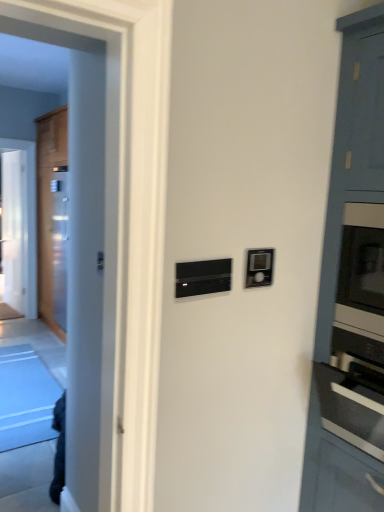
Question: Based on their positions, is black matte thermostat at center located to the left or right of transparent glass door at left?

Choices:
 (A) right
 (B) left

Answer: (A)

Question: From their relative heights in the image, would you say black matte thermostat at center is taller or shorter than transparent glass door at left?

Choices:
 (A) tall
 (B) short

Answer: (B)

Question: Which object is the closest to the satin silver oven at right?

Choices:
 (A) satin black thermostat at upper right
 (B) transparent glass door at left
 (C) black matte thermostat at center
 (D) wooden door at left

Answer: (A)

Question: Which object is positioned farthest from the satin silver oven at right?

Choices:
 (A) satin black thermostat at upper right
 (B) wooden door at left
 (C) black matte thermostat at center
 (D) transparent glass door at left

Answer: (D)